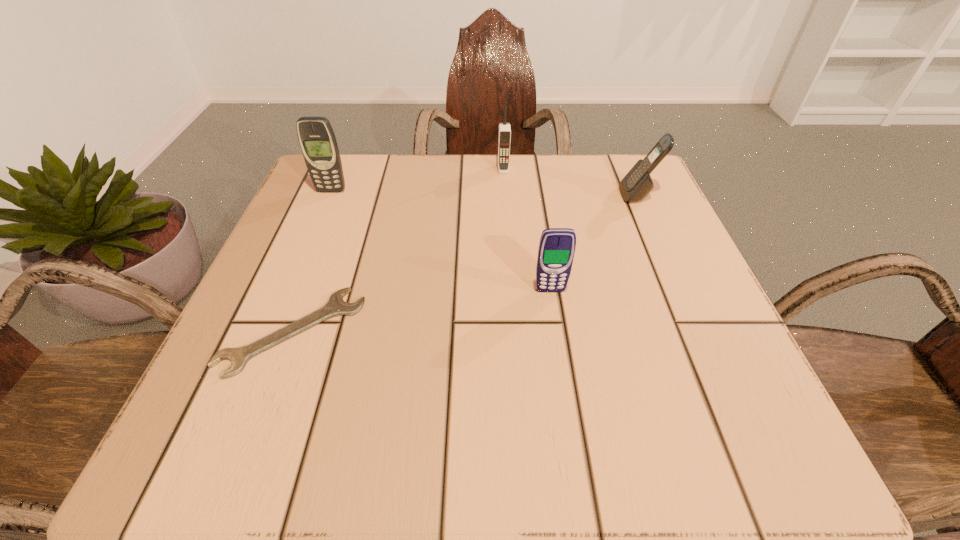
Locate an element on the screen. The image size is (960, 540). vacant region between the leftmost cellular telephone and the nearest cellular telephone is located at coordinates (441, 241).

I want to click on vacant region between the second cellular telephone from right to left and the leftmost cellular telephone, so click(x=441, y=241).

The height and width of the screenshot is (540, 960). Find the location of `vacant region between the rightmost cellular telephone and the farthest cellular telephone`. vacant region between the rightmost cellular telephone and the farthest cellular telephone is located at coordinates (570, 182).

Image resolution: width=960 pixels, height=540 pixels. I want to click on free space between the shortest object and the third cellular telephone from right to left, so click(398, 250).

What are the coordinates of `free spot between the second object from right to left and the leftmost cellular telephone` in the screenshot? It's located at (441, 241).

Image resolution: width=960 pixels, height=540 pixels. I want to click on free space between the nearest cellular telephone and the rightmost object, so click(594, 243).

You are a GUI agent. You are given a task and a screenshot of the screen. Output one action in this format:
    pyautogui.click(x=<x>, y=<y>)
    Task: Click on the fourth closest object to the shortest object
    This screenshot has width=960, height=540.
    Given the screenshot: What is the action you would take?
    pyautogui.click(x=637, y=184)

Where is `object that is the second nearest to the second cellular telephone from left to right`? This screenshot has height=540, width=960. object that is the second nearest to the second cellular telephone from left to right is located at coordinates (317, 140).

Locate an element on the screen. Image resolution: width=960 pixels, height=540 pixels. cellular telephone that is the third nearest to the farthest object is located at coordinates (556, 251).

Locate an element on the screen. cellular telephone object that ranks as the closest to the wrench is located at coordinates pyautogui.click(x=556, y=251).